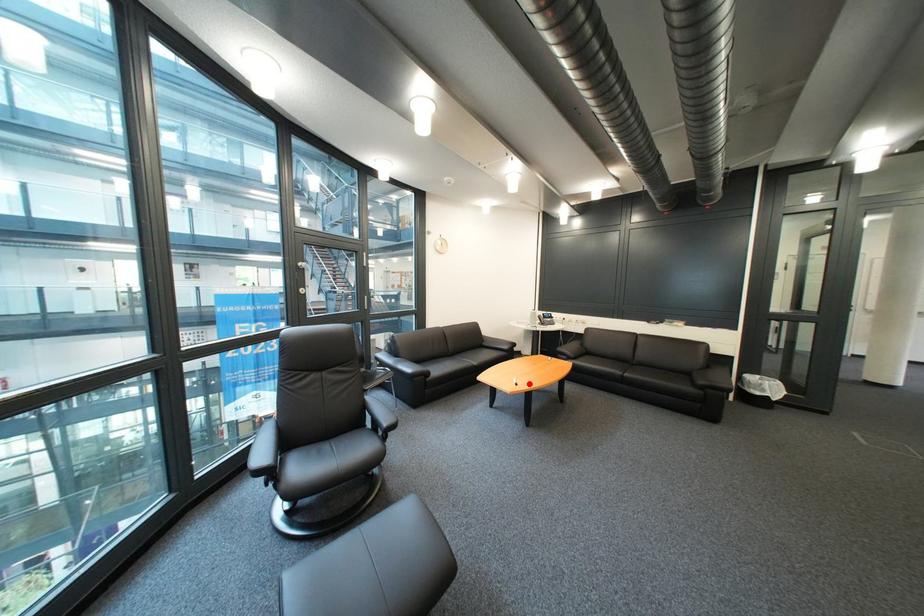
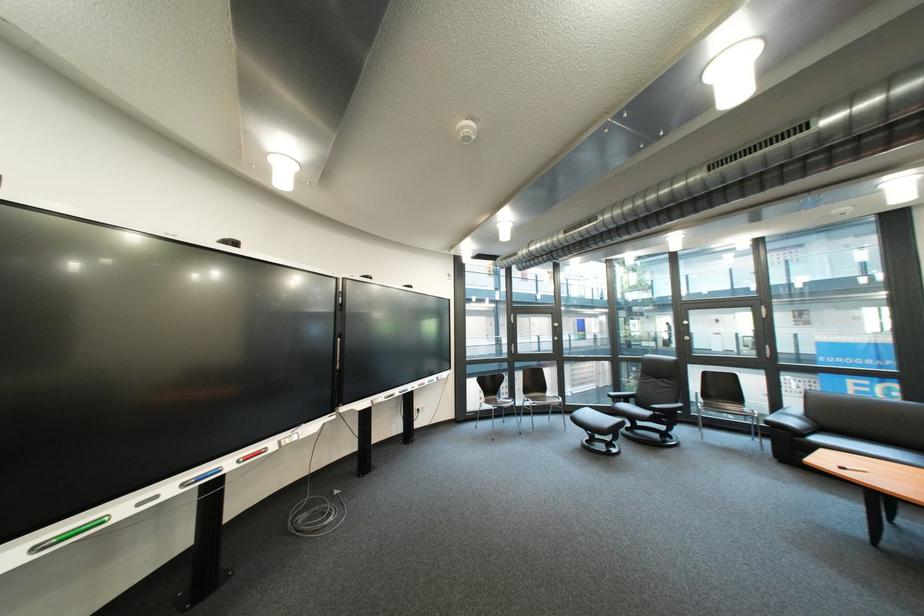
In the second image, find the point that corresponds to the highlighted location in the first image.

(862, 469)